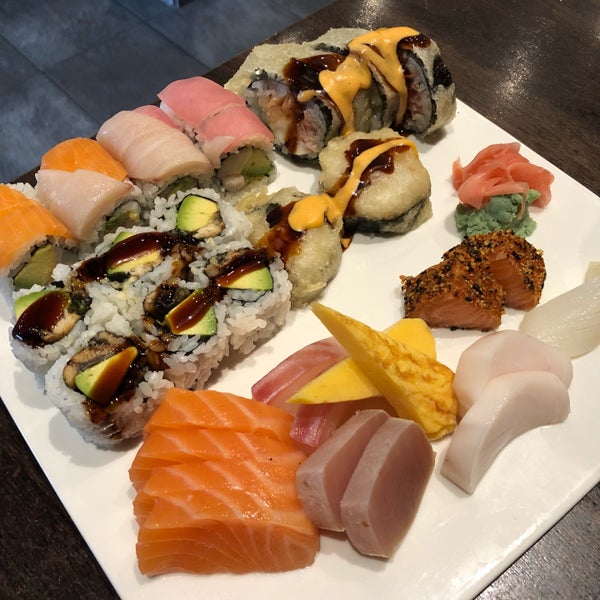
Find the location of a particular element. The image size is (600, 600). white square plate is located at coordinates (369, 294).